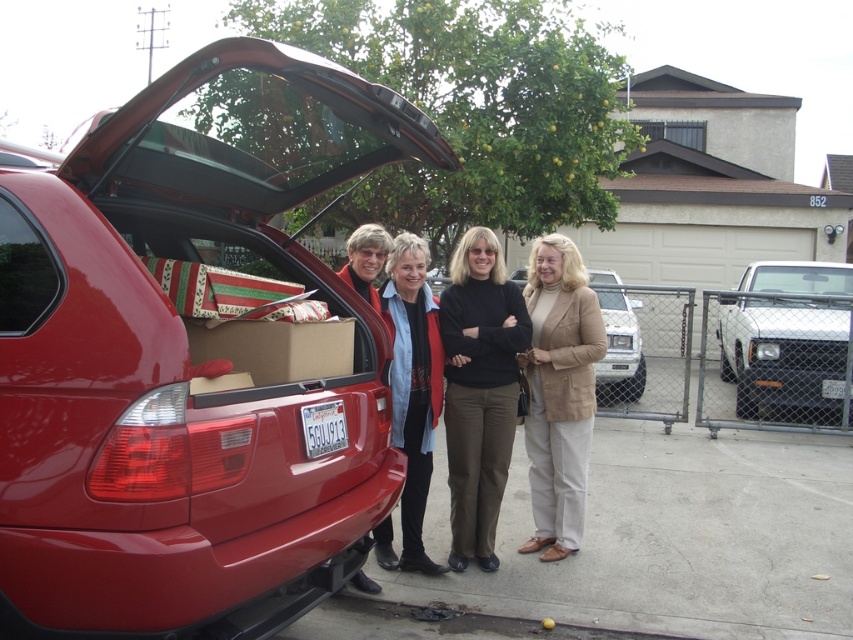
You are organizing a gift delivery and need to load items into the car trunk. The beige fabric jacket at center and the brown cardboard box at center are both ready to be placed. Based on their current positions, which item should you place first into the trunk to maintain the existing arrangement?

The beige fabric jacket at center is located below the brown cardboard box at center, so you should place the brown cardboard box at center first to maintain the existing arrangement.